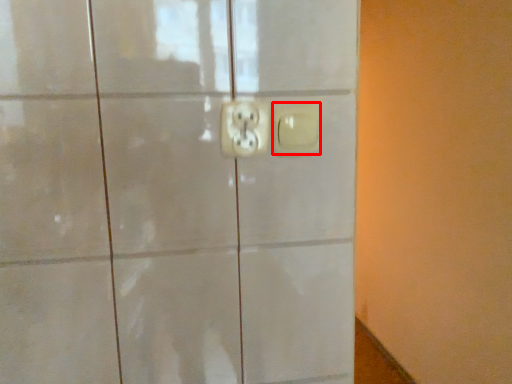
Question: From the image's perspective, where is light switch (annotated by the red box) located relative to power plugs and sockets?

Choices:
 (A) above
 (B) below

Answer: (B)